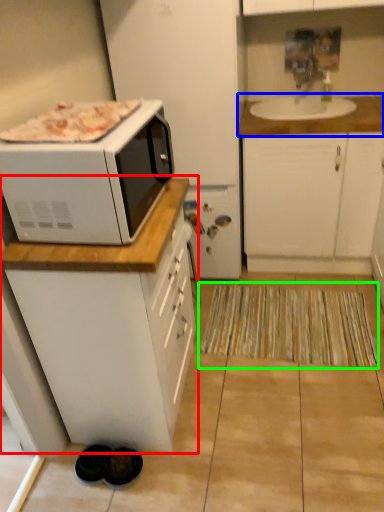
Question: Which object is positioned farthest from cabinetry (highlighted by a red box)? Select from countertop (highlighted by a blue box) and mat (highlighted by a green box).

Choices:
 (A) countertop
 (B) mat

Answer: (A)